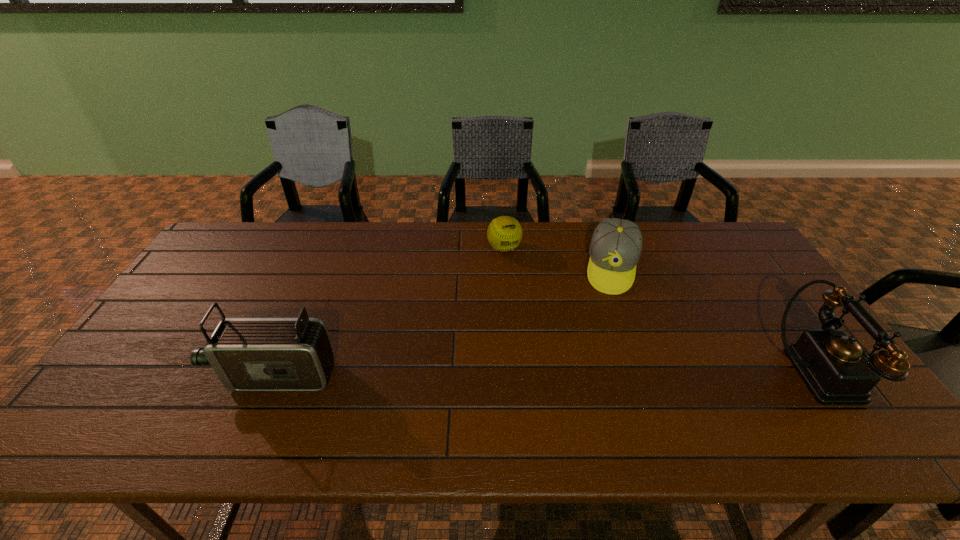
This screenshot has width=960, height=540. In order to click on free space on the desktop that is between the leftmost object and the telephone and is positioned on the logo side of the softball in this screenshot , I will do `click(579, 374)`.

Where is `vacant space on the desktop that is between the leftmost object and the telephone and is positioned on the front-facing side of the third tallest object`? vacant space on the desktop that is between the leftmost object and the telephone and is positioned on the front-facing side of the third tallest object is located at coordinates (597, 374).